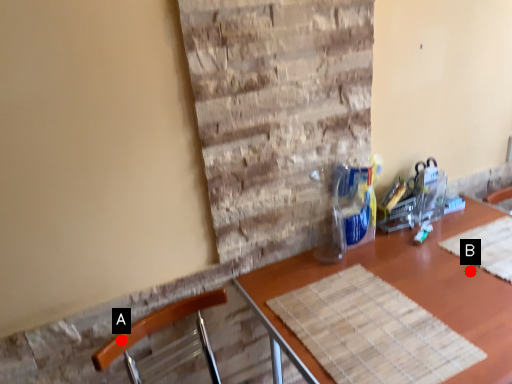
Question: Two points are circled on the image, labeled by A and B beside each circle. Among these points, which one is farthest from the camera?

Choices:
 (A) A is further
 (B) B is further

Answer: (B)